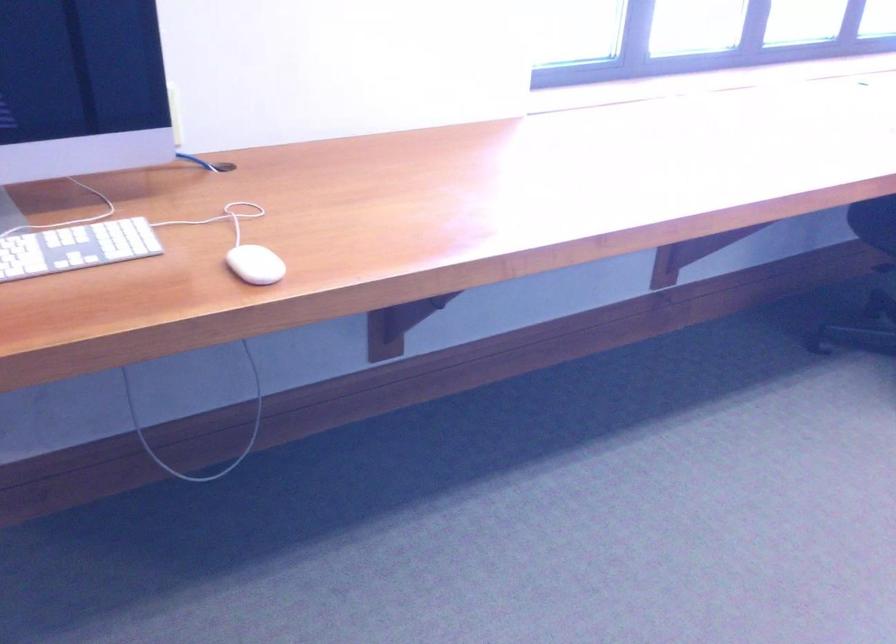
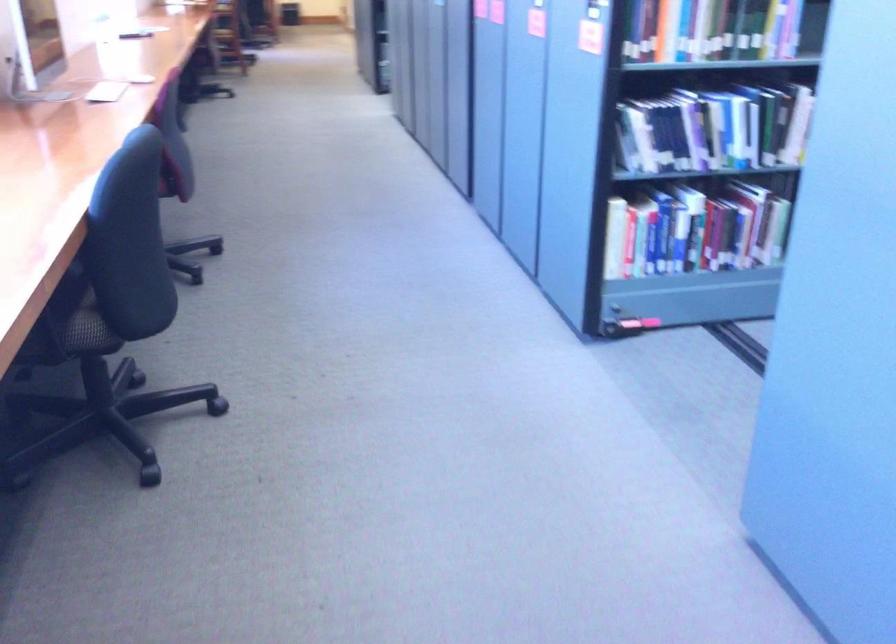
Question: The camera is either moving clockwise (left) or counter-clockwise (right) around the object. The first image is from the beginning of the video and the second image is from the end. Is the camera moving left or right when shooting the video?

Choices:
 (A) Left
 (B) Right

Answer: (A)